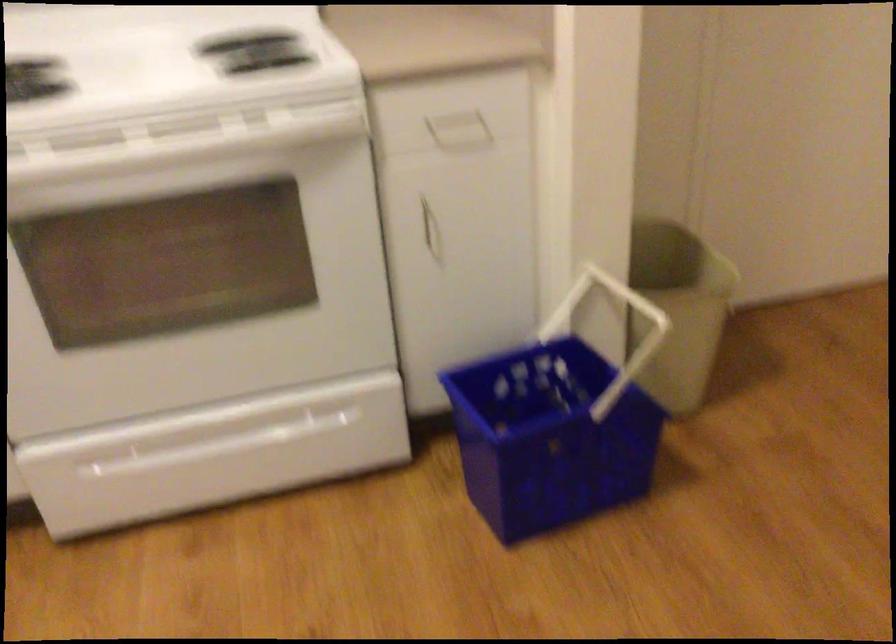
Locate an element on the screen. Image resolution: width=896 pixels, height=644 pixels. white cabinet handle is located at coordinates (431, 234).